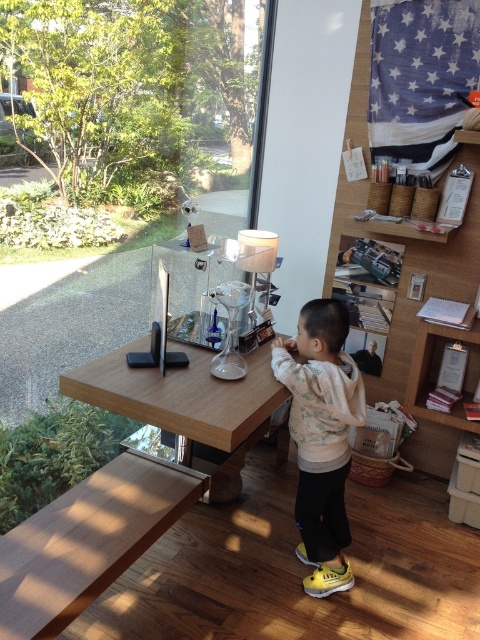
Question: Is wooden bookshelf at right behind light pink fleece sweater at center?

Choices:
 (A) no
 (B) yes

Answer: (B)

Question: Which of the following is the closest to the observer?

Choices:
 (A) wooden table at center
 (B) light pink fleece sweater at center
 (C) brown wood table at lower left

Answer: (C)

Question: Does wooden bookshelf at right come in front of wooden table at center?

Choices:
 (A) yes
 (B) no

Answer: (B)

Question: Is brown wood table at lower left wider than light pink fleece sweater at center?

Choices:
 (A) no
 (B) yes

Answer: (B)

Question: Which point is closer to the camera taking this photo?

Choices:
 (A) (478, 264)
 (B) (252, 426)
 (C) (311, 461)
 (D) (60, 588)

Answer: (D)

Question: Which point is farther from the camera taking this photo?

Choices:
 (A) (321, 401)
 (B) (228, 499)

Answer: (B)